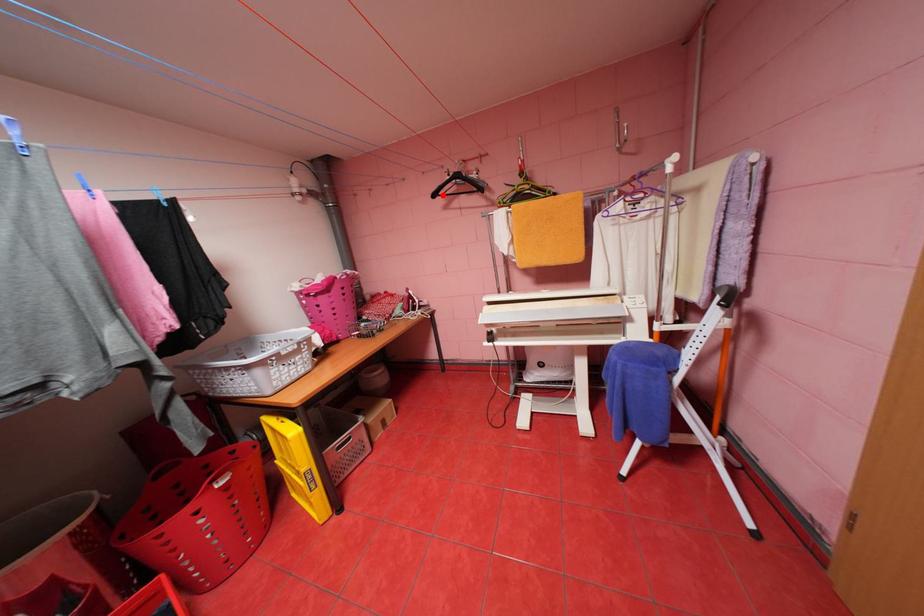
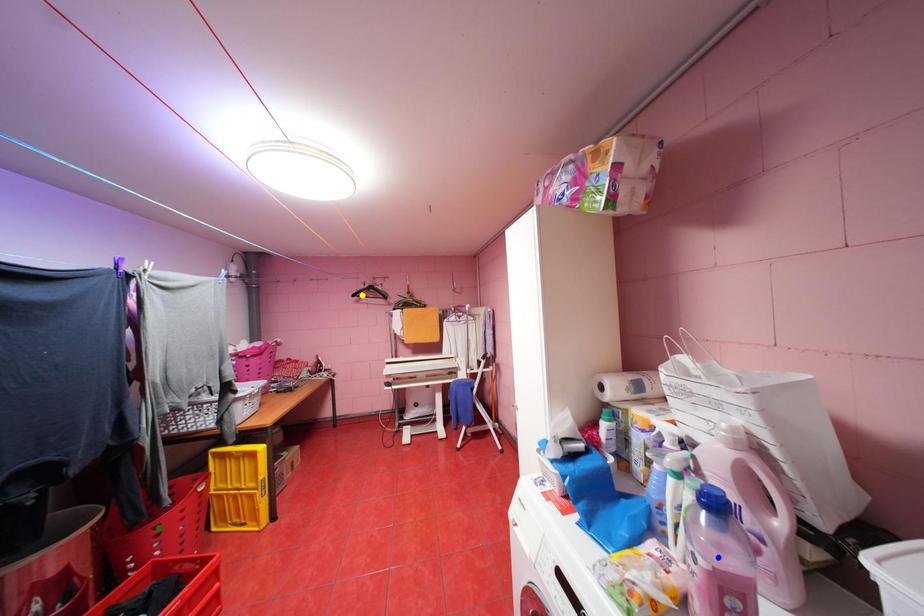
Question: I am providing you with two images of the same scene from different viewpoints. A red point is marked on the first image. You are given multiple points on the second image. In image 2, which mark is for the same physical point as the one in image 1?

Choices:
 (A) green point
 (B) blue point
 (C) yellow point

Answer: (C)